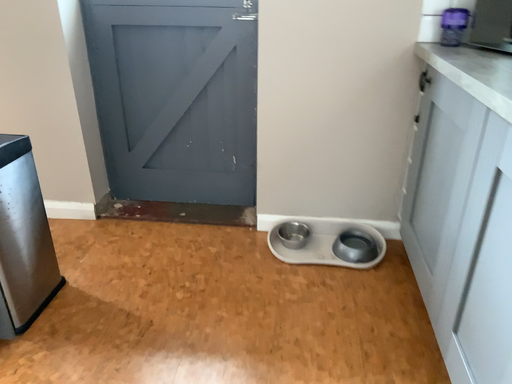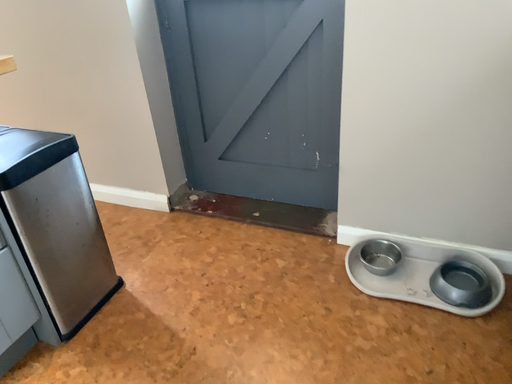
Question: How did the camera likely rotate when shooting the video?

Choices:
 (A) rotated left
 (B) rotated right

Answer: (A)